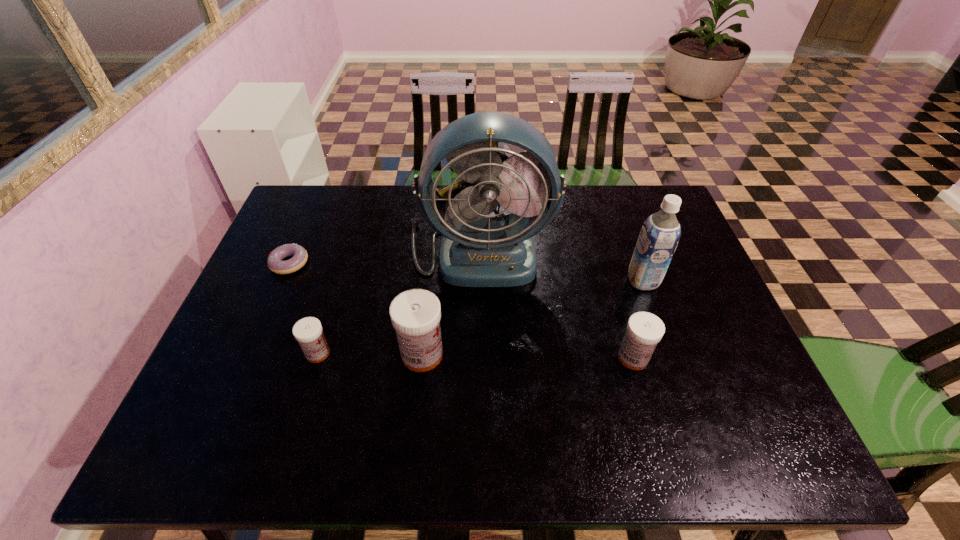
In order to click on vacant region between the second tallest object and the fifth tallest object in this screenshot , I will do `click(480, 317)`.

Identify the location of unoccupied position between the fifth object from left to right and the leftmost object. (462, 310).

The height and width of the screenshot is (540, 960). Find the location of `unoccupied area between the shortest medicine and the rightmost object`. unoccupied area between the shortest medicine and the rightmost object is located at coordinates (480, 317).

This screenshot has height=540, width=960. In order to click on free space between the doughnut and the fan in this screenshot , I will do `click(384, 256)`.

Image resolution: width=960 pixels, height=540 pixels. What are the coordinates of `the fourth closest object relative to the leftmost object` in the screenshot? It's located at [x=644, y=331].

This screenshot has width=960, height=540. Identify the location of object that is the closest to the fan. (415, 314).

Locate an element on the screen. medicine object that ranks as the second closest to the rightmost medicine is located at coordinates pos(308,331).

Identify which medicine is located as the second nearest to the leftmost medicine. Please provide its 2D coordinates. Your answer should be formatted as a tuple, i.e. [(x, y)], where the tuple contains the x and y coordinates of a point satisfying the conditions above.

[(644, 331)]

The image size is (960, 540). I want to click on vacant position in the image that satisfies the following two spatial constraints: 1. on the front side of the shortest object; 2. on the right side of the shortest medicine, so click(251, 353).

Where is `vacant space that satisfies the following two spatial constraints: 1. in front of the fan to blow air; 2. on the left side of the fourth tallest object`? Image resolution: width=960 pixels, height=540 pixels. vacant space that satisfies the following two spatial constraints: 1. in front of the fan to blow air; 2. on the left side of the fourth tallest object is located at coordinates (479, 357).